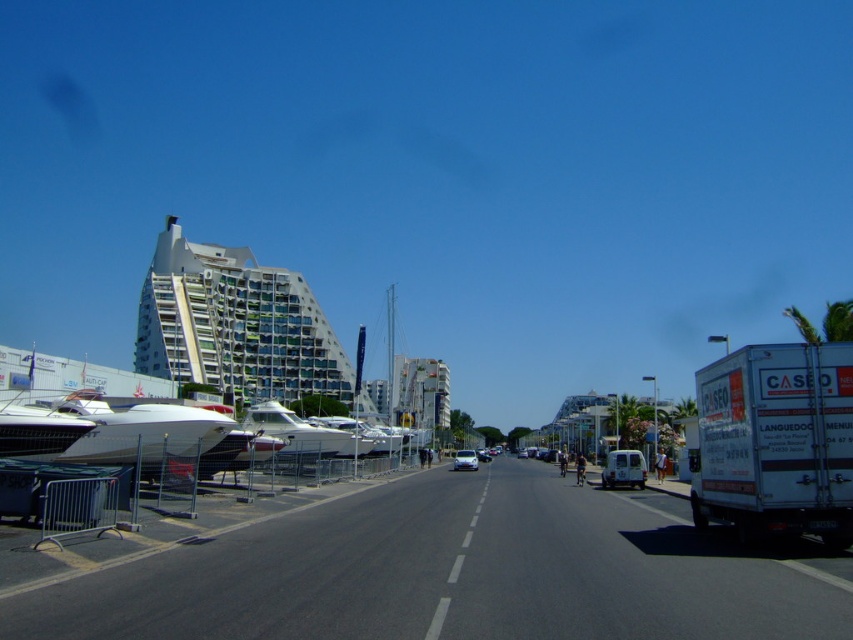
Is white glossy boat at center to the left of white matte van at center from the viewer's perspective?

Correct, you'll find white glossy boat at center to the left of white matte van at center.

Is white glossy boat at center above white matte van at center?

Yes.

The height and width of the screenshot is (640, 853). What do you see at coordinates (363, 435) in the screenshot?
I see `white glossy boat at center` at bounding box center [363, 435].

Where is `white glossy boat at center`? The width and height of the screenshot is (853, 640). white glossy boat at center is located at coordinates (363, 435).

How far apart are white glossy boat at left and silver metallic car at center?

white glossy boat at left and silver metallic car at center are 36.89 meters apart from each other.

Which is below, white glossy boat at left or silver metallic car at center?

Positioned lower is silver metallic car at center.

Is point (120, 436) closer to camera compared to point (477, 461)?

Yes, it is.

Locate an element on the screen. This screenshot has height=640, width=853. white glossy boat at left is located at coordinates (138, 432).

Between white glossy yacht at center and white matte van at center, which one has less height?

white glossy yacht at center

Between point (267, 424) and point (612, 477), which one is positioned behind?

Positioned behind is point (267, 424).

At what (x,y) coordinates should I click in order to perform the action: click on white glossy yacht at center. Please return your answer as a coordinate pair (x, y). Image resolution: width=853 pixels, height=640 pixels. Looking at the image, I should click on (302, 432).